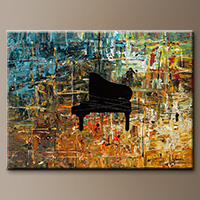
Identify the location of abstract art. coord(160,158).